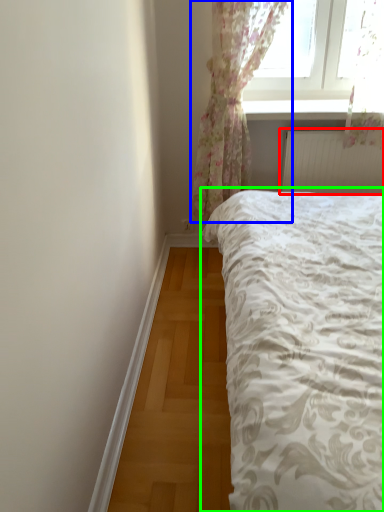
Question: Which object is the closest to the radiator (highlighted by a red box)? Choose among these: curtain (highlighted by a blue box) or bed (highlighted by a green box).

Choices:
 (A) curtain
 (B) bed

Answer: (A)